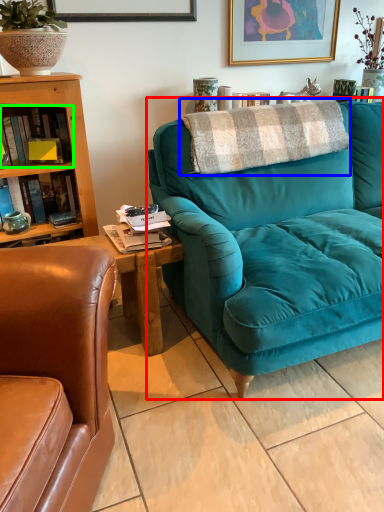
Question: Which object is the closest to the studio couch (highlighted by a red box)? Choose among these: blanket (highlighted by a blue box) or book (highlighted by a green box).

Choices:
 (A) blanket
 (B) book

Answer: (A)